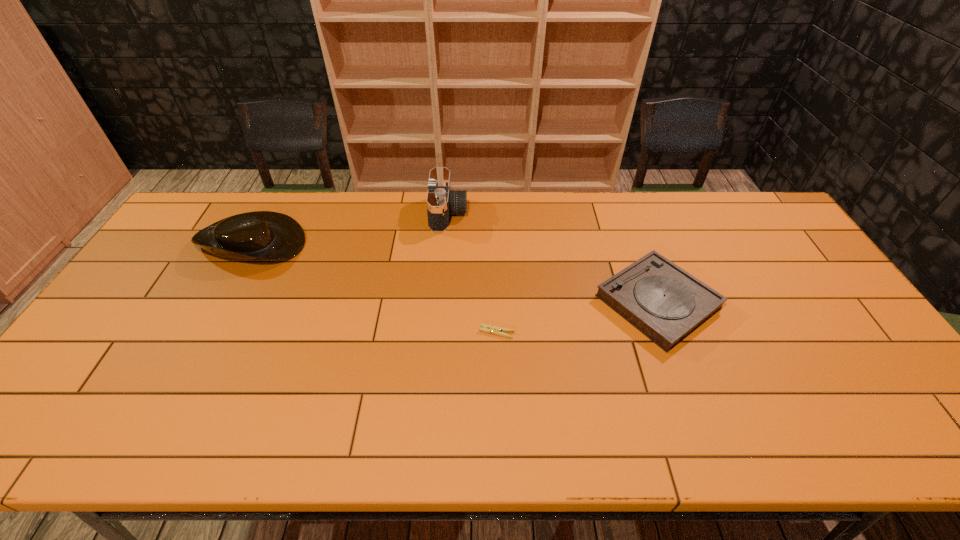
At what (x,y) coordinates should I click in order to perform the action: click on vacant region located 0.250m on the back of the second shortest object. Please return your answer as a coordinate pair (x, y). Looking at the image, I should click on (624, 210).

This screenshot has width=960, height=540. What are the coordinates of `vacant space located on the right of the second object from right to left` in the screenshot? It's located at (662, 332).

Where is `camera positioned at the far edge`? camera positioned at the far edge is located at coordinates (441, 201).

Find the location of a particular element. cowboy hat that is at the far edge is located at coordinates (269, 235).

What are the coordinates of `object positioned at the left edge` in the screenshot? It's located at (269, 235).

Where is `object that is at the far left corner`? This screenshot has height=540, width=960. object that is at the far left corner is located at coordinates (269, 235).

In order to click on vacant space at the far edge in this screenshot , I will do `click(732, 227)`.

In order to click on free space at the near edge of the desktop in this screenshot , I will do `click(744, 429)`.

The height and width of the screenshot is (540, 960). In the image, there is a desktop. Identify the location of vacant area at the left edge. (109, 379).

You are a GUI agent. You are given a task and a screenshot of the screen. Output one action in this format:
    pyautogui.click(x=<x>, y=<y>)
    Task: Click on the vacant space at the right edge of the desktop
    Image resolution: width=960 pixels, height=540 pixels.
    Given the screenshot: What is the action you would take?
    pyautogui.click(x=802, y=319)